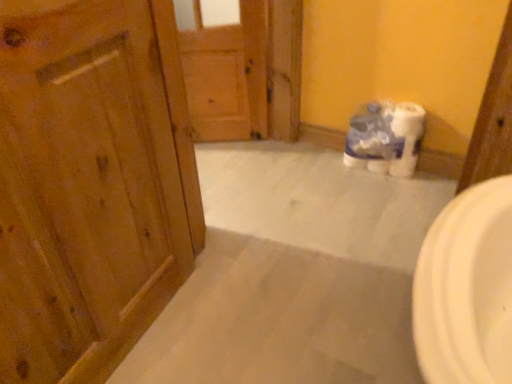
Question: Is white plastic toilet paper at center facing away from wooden door at center, which ranks as the first door in back-to-front order?

Choices:
 (A) no
 (B) yes

Answer: (A)

Question: Is the depth of white plastic toilet paper at center greater than that of wooden door at center, the 2th door viewed from the front?

Choices:
 (A) no
 (B) yes

Answer: (A)

Question: From the image's perspective, does white plastic toilet paper at center appear higher than wooden door at center, the 2th door viewed from the front?

Choices:
 (A) yes
 (B) no

Answer: (B)

Question: Can you confirm if white plastic toilet paper at center is bigger than wooden door at center, which ranks as the first door in back-to-front order?

Choices:
 (A) no
 (B) yes

Answer: (B)

Question: Can you confirm if white plastic toilet paper at center is shorter than wooden door at center, which ranks as the first door in back-to-front order?

Choices:
 (A) no
 (B) yes

Answer: (B)

Question: From a real-world perspective, is wooden door at left, which is counted as the 2th door, starting from the back, above or below wooden door at center, the 2th door viewed from the front?

Choices:
 (A) below
 (B) above

Answer: (B)

Question: In terms of width, does wooden door at left, the 1th door positioned from the front, look wider or thinner when compared to wooden door at center, which ranks as the first door in back-to-front order?

Choices:
 (A) thin
 (B) wide

Answer: (B)

Question: Considering the relative positions of wooden door at left, the 1th door positioned from the front, and wooden door at center, which ranks as the first door in back-to-front order, in the image provided, is wooden door at left, the 1th door positioned from the front, to the left or to the right of wooden door at center, which ranks as the first door in back-to-front order,?

Choices:
 (A) left
 (B) right

Answer: (A)

Question: Relative to wooden door at center, the 2th door viewed from the front, is wooden door at left, the 1th door positioned from the front, in front or behind?

Choices:
 (A) behind
 (B) front

Answer: (B)

Question: Does point (245, 110) appear closer or farther from the camera than point (42, 82)?

Choices:
 (A) farther
 (B) closer

Answer: (A)

Question: Considering the positions of wooden door at center, the 2th door viewed from the front, and wooden door at left, which is counted as the 2th door, starting from the back, in the image, is wooden door at center, the 2th door viewed from the front, bigger or smaller than wooden door at left, which is counted as the 2th door, starting from the back,?

Choices:
 (A) big
 (B) small

Answer: (B)

Question: Which is correct: wooden door at center, the 2th door viewed from the front, is inside wooden door at left, which is counted as the 2th door, starting from the back, or outside of it?

Choices:
 (A) inside
 (B) outside

Answer: (B)

Question: From the image's perspective, is wooden door at center, the 2th door viewed from the front, positioned above or below wooden door at left, the 1th door positioned from the front?

Choices:
 (A) below
 (B) above

Answer: (B)

Question: Is white plastic toilet paper at center bigger or smaller than wooden door at left, the 1th door positioned from the front?

Choices:
 (A) small
 (B) big

Answer: (A)

Question: In terms of width, does white plastic toilet paper at center look wider or thinner when compared to wooden door at left, the 1th door positioned from the front?

Choices:
 (A) thin
 (B) wide

Answer: (B)